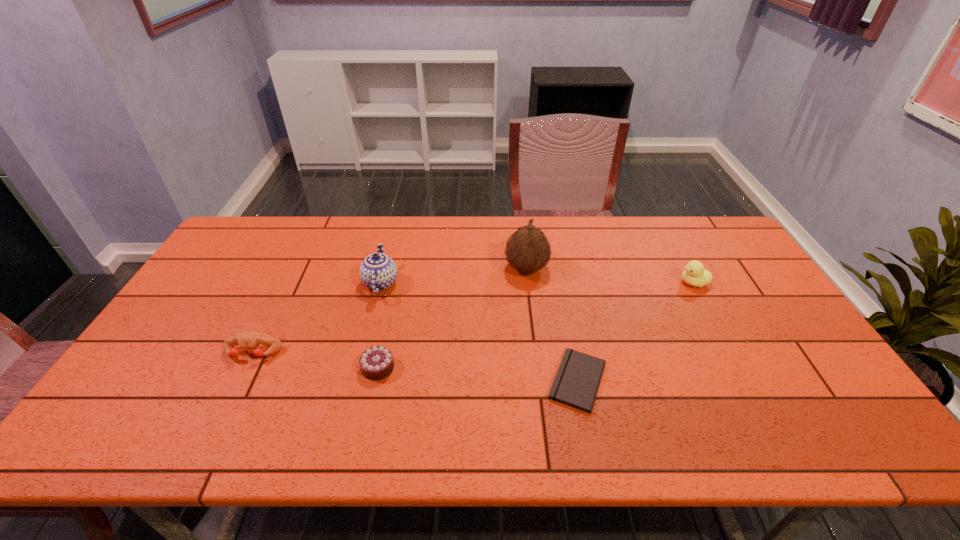
The width and height of the screenshot is (960, 540). I want to click on free space that is in between the second tallest object and the tallest object, so click(x=453, y=275).

The height and width of the screenshot is (540, 960). I want to click on free spot between the rightmost object and the coconut, so click(610, 275).

At what (x,y) coordinates should I click in order to perform the action: click on vacant area that lies between the puncher and the chocolate cake. Please return your answer as a coordinate pair (x, y). The height and width of the screenshot is (540, 960). Looking at the image, I should click on (316, 360).

Where is `free space between the tallest object and the shortest object`? Image resolution: width=960 pixels, height=540 pixels. free space between the tallest object and the shortest object is located at coordinates (552, 324).

You are a GUI agent. You are given a task and a screenshot of the screen. Output one action in this format:
    pyautogui.click(x=<x>, y=<y>)
    Task: Click on the free space between the chocolate cake and the coconut
    
    Given the screenshot: What is the action you would take?
    pyautogui.click(x=452, y=318)

At what (x,y) coordinates should I click in order to perform the action: click on the fourth closest object to the shortest object. Please return your answer as a coordinate pair (x, y). The height and width of the screenshot is (540, 960). Looking at the image, I should click on (378, 272).

Where is `object that is the third closest to the second tallest object`? The height and width of the screenshot is (540, 960). object that is the third closest to the second tallest object is located at coordinates (528, 250).

Where is `vacant space that satisfies the following two spatial constraints: 1. with the gloves of the puncher facing forward; 2. on the left side of the chocolate cake`? vacant space that satisfies the following two spatial constraints: 1. with the gloves of the puncher facing forward; 2. on the left side of the chocolate cake is located at coordinates (246, 368).

At what (x,y) coordinates should I click in order to perform the action: click on vacant region that satisfies the following two spatial constraints: 1. on the surface of the shortest object; 2. on the right side of the tallest object. Please return your answer as a coordinate pair (x, y). Looking at the image, I should click on (540, 381).

Identify the location of free spot that satisfies the following two spatial constraints: 1. on the surface of the tallest object; 2. on the back side of the shortest object. Image resolution: width=960 pixels, height=540 pixels. (540, 381).